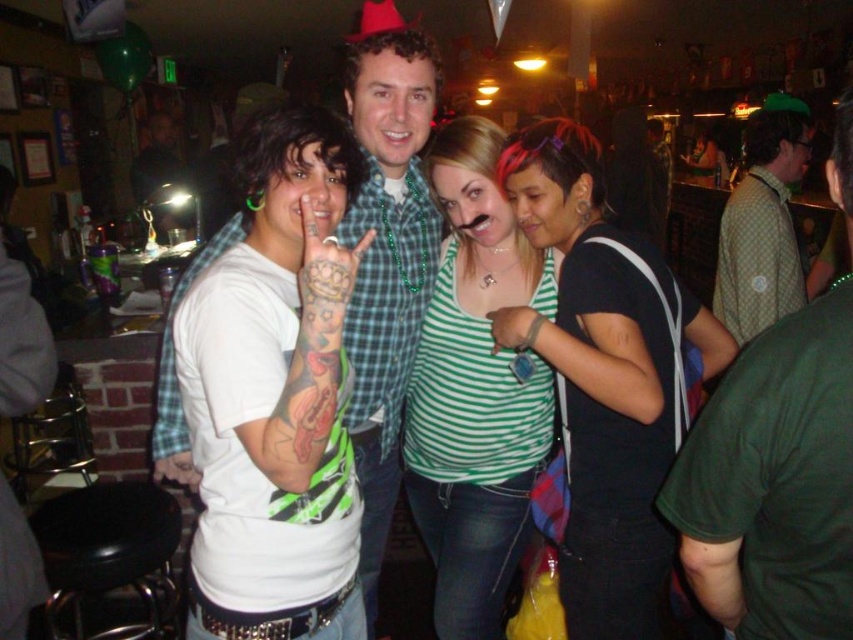
Measure the distance between point (613, 360) and camera.

They are 4.64 feet apart.

Between black fabric shirt at center and black leather stool at lower left, which one appears on the left side from the viewer's perspective?

black leather stool at lower left

Between point (552, 157) and point (49, 548), which one is positioned in front?

Point (552, 157) is in front.

Where is `black fabric shirt at center`? black fabric shirt at center is located at coordinates (605, 376).

Does black fabric shirt at center have a lesser height compared to matte green shirt at center?

Yes, black fabric shirt at center is shorter than matte green shirt at center.

Looking at this image, measure the distance between point (613, 550) and camera.

Point (613, 550) is 5.17 feet from camera.

Identify the location of black fabric shirt at center. 605,376.

Between black fabric shirt at center and green striped tank top at center, which one has less height?

black fabric shirt at center is shorter.

Image resolution: width=853 pixels, height=640 pixels. I want to click on black fabric shirt at center, so click(x=605, y=376).

The height and width of the screenshot is (640, 853). In order to click on black fabric shirt at center in this screenshot , I will do `click(605, 376)`.

Identify the location of black fabric shirt at center. The width and height of the screenshot is (853, 640). pyautogui.click(x=605, y=376).